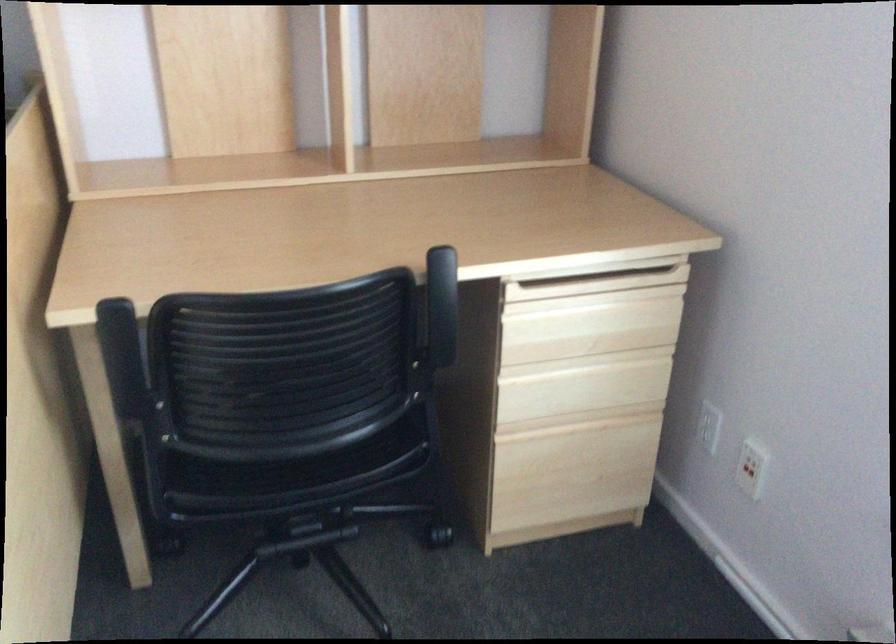
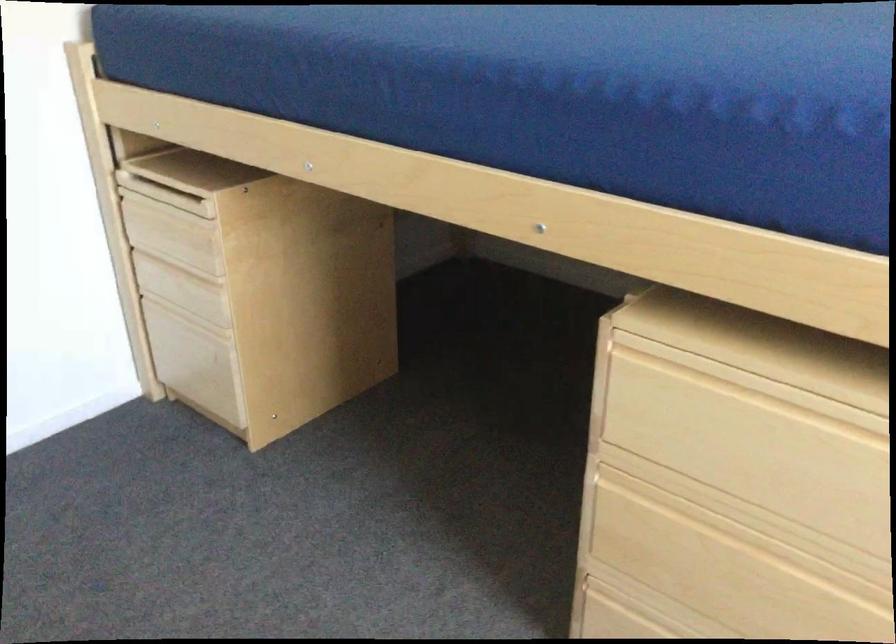
Question: Based on the continuous images, in which direction is the camera rotating? Reply with the corresponding letter.

Choices:
 (A) Left
 (B) Right
 (C) Up
 (D) Down

Answer: (A)